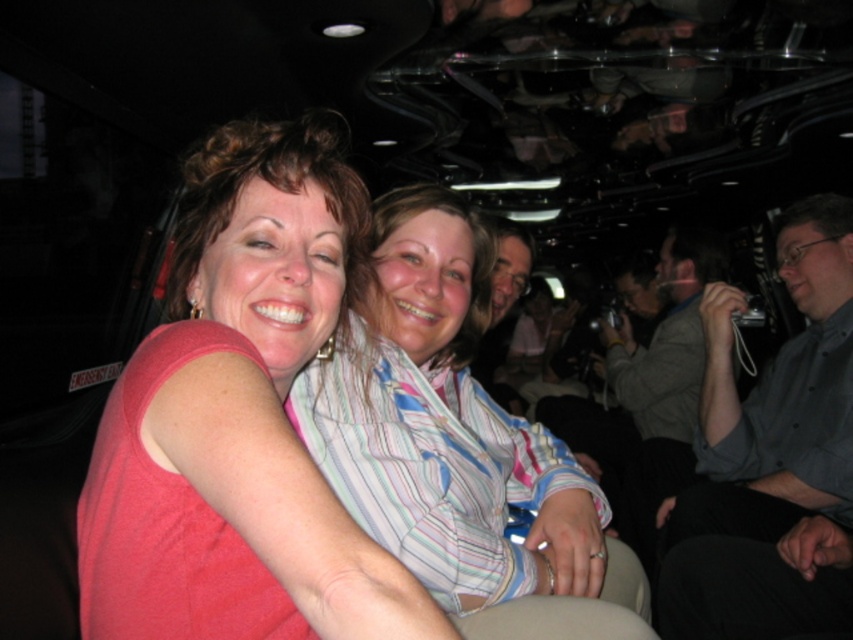
Question: Does striped cotton shirt at center have a larger size compared to smooth gray shirt at center?

Choices:
 (A) yes
 (B) no

Answer: (A)

Question: Is matte pink shirt at center closer to the viewer compared to gray button-down shirt at right?

Choices:
 (A) yes
 (B) no

Answer: (A)

Question: Which of the following is the farthest from the observer?

Choices:
 (A) (605, 584)
 (B) (509, 220)

Answer: (B)

Question: Can you confirm if matte pink shirt at center is bigger than smooth gray shirt at center?

Choices:
 (A) no
 (B) yes

Answer: (B)

Question: Which point appears closest to the camera in this image?

Choices:
 (A) (502, 234)
 (B) (426, 292)
 (C) (181, 292)

Answer: (C)

Question: Which of the following is the closest to the observer?

Choices:
 (A) matte pink shirt at center
 (B) striped cotton shirt at center

Answer: (A)